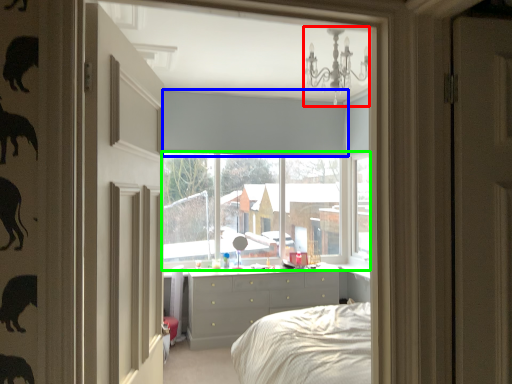
Question: Considering the real-world distances, which object is farthest from light fixture (highlighted by a red box)? blind (highlighted by a blue box) or window (highlighted by a green box)?

Choices:
 (A) blind
 (B) window

Answer: (B)